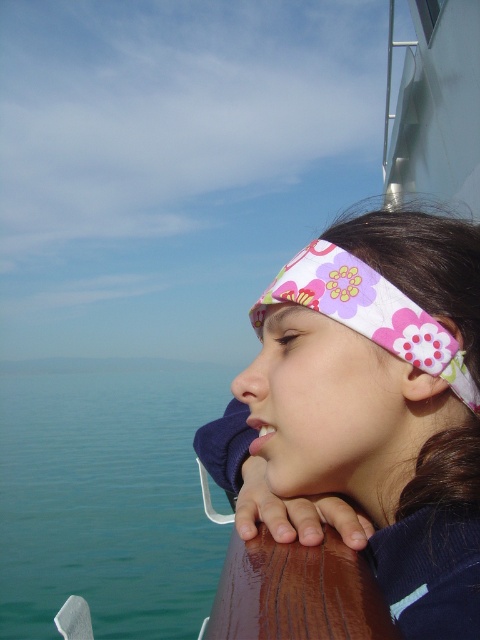
You are an artist planning to paint this scene. You need to decide which object, the blue water at lower left or the floral fabric headband at center, requires more space on the canvas. Based on their sizes in the image, which one should you allocate more canvas area to?

The blue water at lower left requires more canvas area because its width is larger than the floral fabric headband at center.

In the scene shown: You are an artist trying to paint this scene. You want to ensure the blue water at lower left and the floral fabric headband at center are proportionally accurate. Which object should you paint first to maintain proper scale, and why?

You should paint the blue water at lower left first because it has a larger size compared to the floral fabric headband at center, so starting with the larger object ensures the smaller one can be scaled appropriately afterward.

You are standing on the deck of a boat and want to locate the blue water at lower left. According to the coordinates provided, where exactly should you look?

You should look at point 0.777 on the x axis and 0.223 on the y axis to find the blue water at lower left.